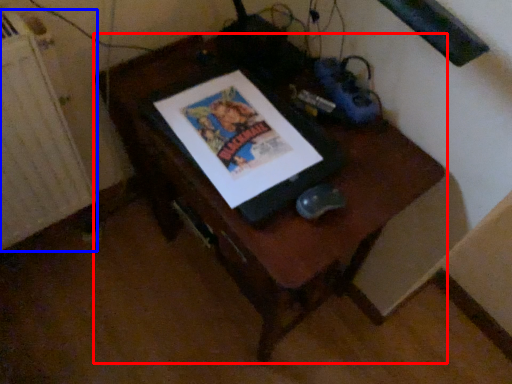
Question: Among these objects, which one is nearest to the camera, furniture (highlighted by a red box) or radiator (highlighted by a blue box)?

Choices:
 (A) furniture
 (B) radiator

Answer: (A)